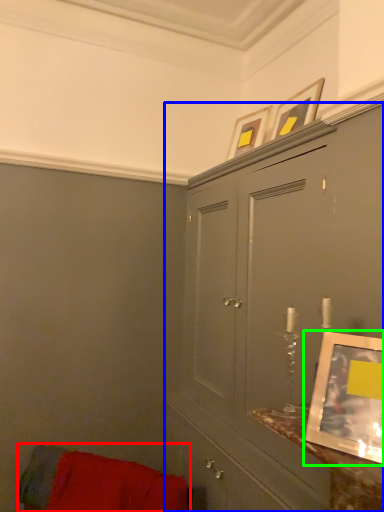
Question: Which object is the farthest from furniture (highlighted by a red box)? Choose among these: cabinetry (highlighted by a blue box) or picture frame (highlighted by a green box).

Choices:
 (A) cabinetry
 (B) picture frame

Answer: (B)